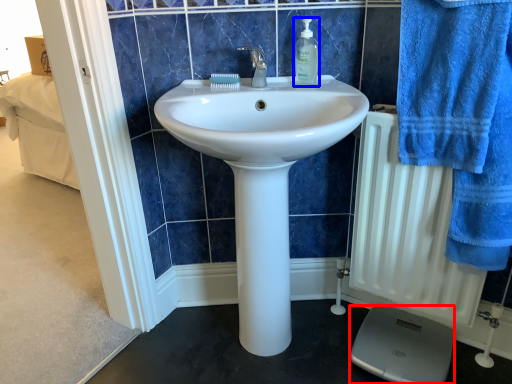
Question: Which of the following is the farthest to the observer, scale (highlighted by a red box) or soap dispenser (highlighted by a blue box)?

Choices:
 (A) scale
 (B) soap dispenser

Answer: (A)